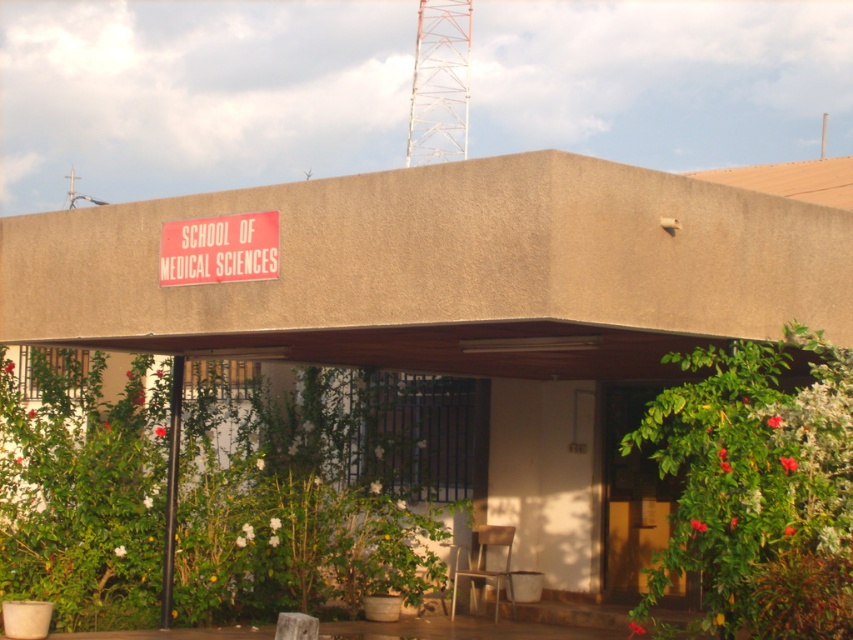
Question: Does brown wooden door at center appear on the left side of red matte sign at upper center?

Choices:
 (A) yes
 (B) no

Answer: (B)

Question: Among these points, which one is farthest from the camera?

Choices:
 (A) (653, 548)
 (B) (169, 248)

Answer: (A)

Question: Among these points, which one is farthest from the camera?

Choices:
 (A) (177, 227)
 (B) (643, 477)

Answer: (B)

Question: Which of the following is the closest to the observer?

Choices:
 (A) brown wooden door at center
 (B) red matte sign at upper center

Answer: (B)

Question: Where is brown wooden door at center located in relation to red matte sign at upper center in the image?

Choices:
 (A) above
 (B) below

Answer: (B)

Question: Is brown wooden door at center wider than red matte sign at upper center?

Choices:
 (A) no
 (B) yes

Answer: (B)